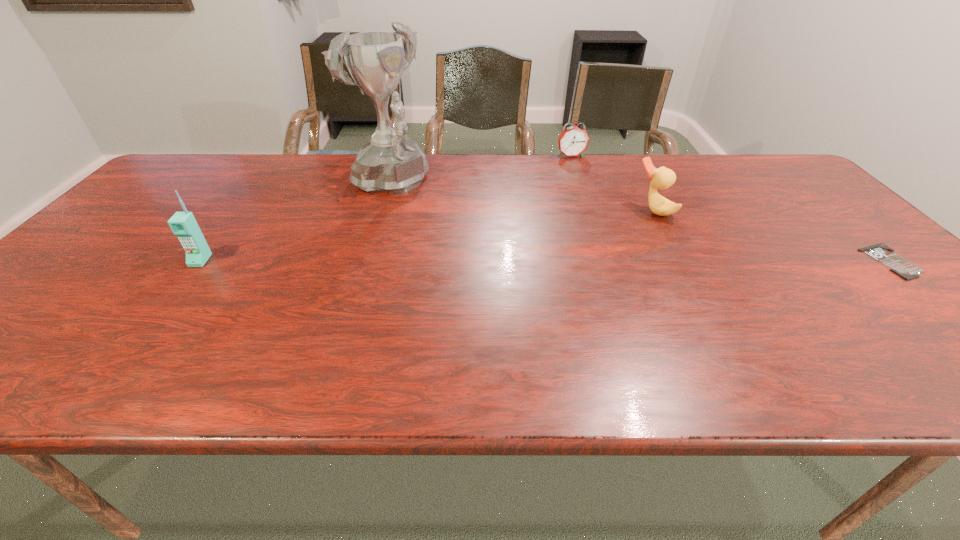
Identify the location of vacant space on the desktop that is between the cellular telephone and the shortest object and is positioned on the clock face of the alarm clock. This screenshot has width=960, height=540. (637, 261).

The image size is (960, 540). Find the location of `vacant space on the desktop that is between the cellular telephone and the rightmost object and is positioned on the side with emblem of the tallest object`. vacant space on the desktop that is between the cellular telephone and the rightmost object and is positioned on the side with emblem of the tallest object is located at coordinates (524, 261).

The width and height of the screenshot is (960, 540). Find the location of `vacant space on the desktop that is between the cellular telephone and the rightmost object and is positioned on the beak of the duck`. vacant space on the desktop that is between the cellular telephone and the rightmost object and is positioned on the beak of the duck is located at coordinates (534, 261).